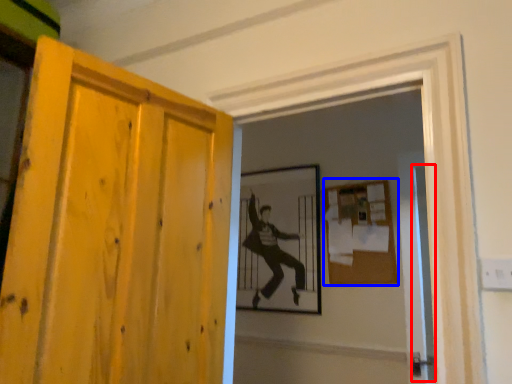
Question: Which object appears farthest to the camera in this image, screen door (highlighted by a red box) or bulletin board (highlighted by a blue box)?

Choices:
 (A) screen door
 (B) bulletin board

Answer: (B)